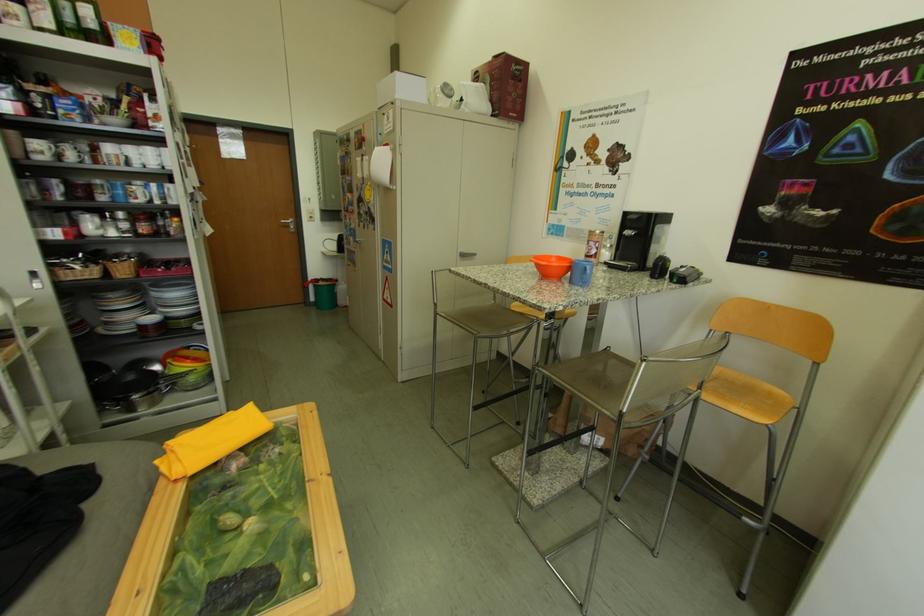
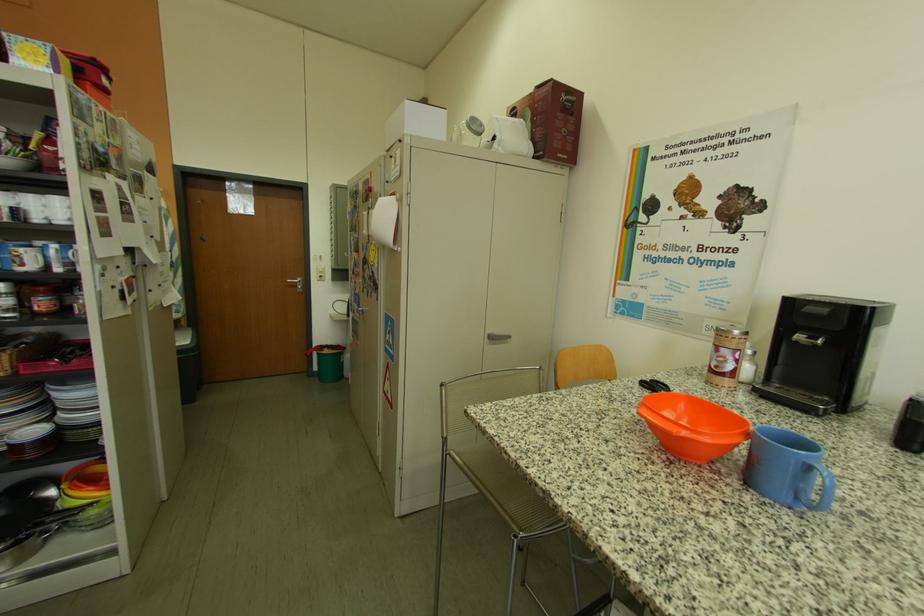
In the second image, find the point that corresponds to (x=451, y=317) in the first image.

(460, 456)